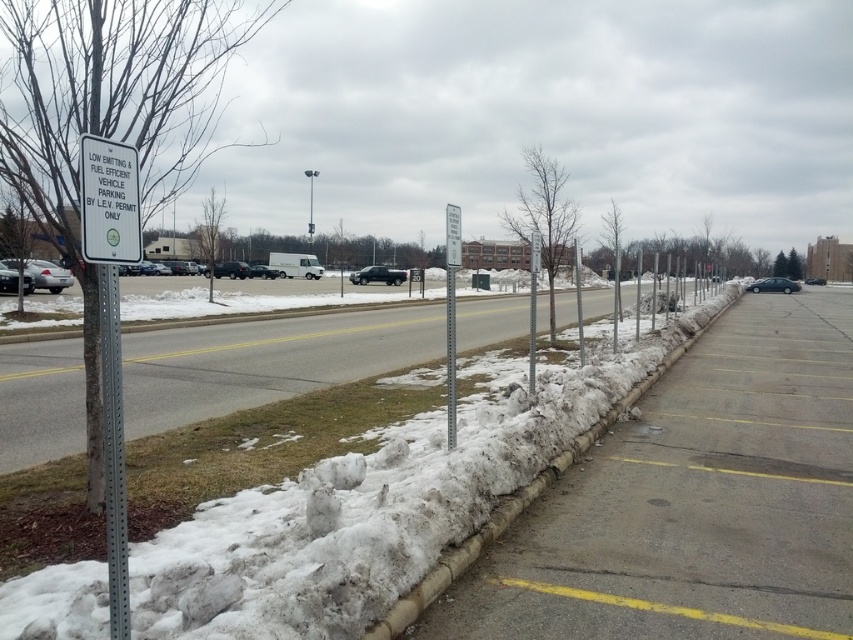
Question: Which of the following is the farthest from the observer?

Choices:
 (A) (373, 269)
 (B) (97, 193)
 (C) (250, 637)
 (D) (54, 289)

Answer: (A)

Question: Among these objects, which one is nearest to the camera?

Choices:
 (A) white plastic sign at left
 (B) metallic blue sedan at right

Answer: (A)

Question: Can you confirm if gray asphalt pavement at center is positioned to the right of metallic gray pole at center?

Choices:
 (A) yes
 (B) no

Answer: (A)

Question: Does white fluffy snow at center have a greater width compared to metallic gray pole at left?

Choices:
 (A) no
 (B) yes

Answer: (B)

Question: Among these points, which one is farthest from the camera?

Choices:
 (A) (370, 266)
 (B) (764, 428)
 (C) (94, 205)

Answer: (A)

Question: Is white fluffy snow at center further to the viewer compared to metallic gray pole at center?

Choices:
 (A) yes
 (B) no

Answer: (B)